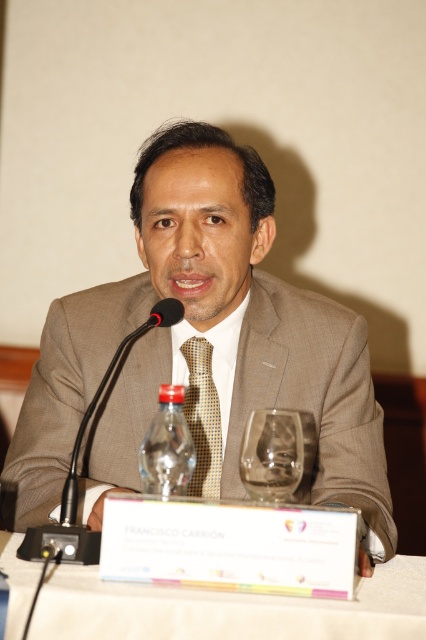
You are a photographer at the back of the room. You want to take a photo of the brown textured suit at center and the black matte microphone at left so that both are clearly visible. Which object should you focus on first to ensure both are in focus?

You should focus on the brown textured suit at center first because it is closer to the viewer than the black matte microphone at left, so focusing on the closer object will help both be in focus.

You are standing at the front of the stage looking at the table where the man is speaking. There are two points marked on the table. One is at point (57,328) and the other is at point (161,452). From your perspective, which point is closer to the back of the stage?

Point (57,328) is behind point (161,452), so from your perspective at the front of the stage, point (57,328) is closer to the back of the stage.

You are a photographer at the event and need to capture a closeup of the clear plastic bottle at center without the brown textured suit at center appearing in the background. Is this possible based on their positions?

The brown textured suit at center is further to the viewer than the clear plastic bottle at center, so the bottle is behind the suit. Therefore, it would be difficult to capture a closeup of the bottle without the suit appearing in the foreground.